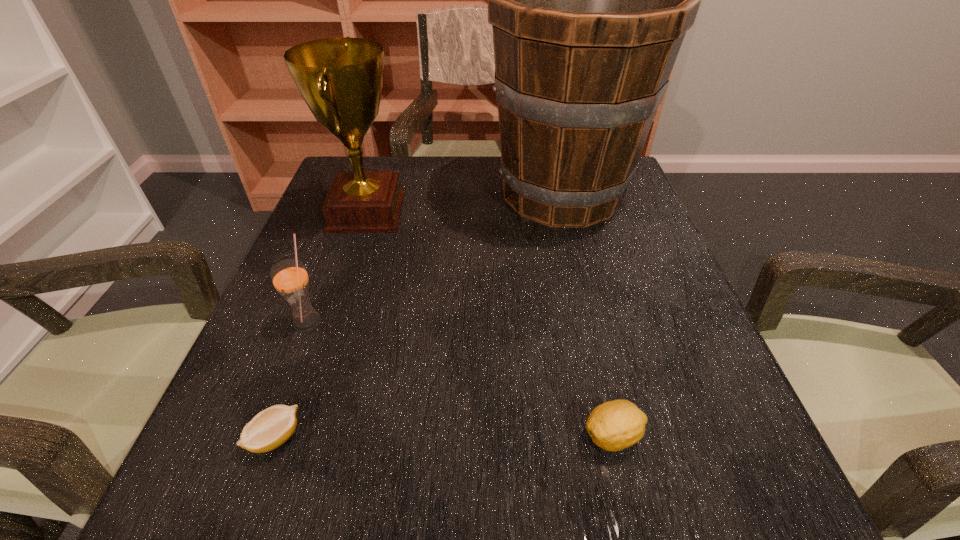
This screenshot has height=540, width=960. In order to click on free space at the near left corner in this screenshot , I will do `click(270, 508)`.

Where is `vacant space at the near right corner`? Image resolution: width=960 pixels, height=540 pixels. vacant space at the near right corner is located at coordinates (656, 457).

I want to click on free space between the straw and the second shortest object, so click(x=460, y=378).

Locate an element on the screen. Image resolution: width=960 pixels, height=540 pixels. empty location between the tallest object and the second tallest object is located at coordinates (465, 204).

This screenshot has height=540, width=960. Find the location of `empty space between the tallest object and the taller lemon`. empty space between the tallest object and the taller lemon is located at coordinates tap(588, 315).

This screenshot has width=960, height=540. I want to click on vacant region between the right lemon and the bucket, so pos(588,315).

Locate an element on the screen. The image size is (960, 540). vacant area that lies between the bucket and the third farthest object is located at coordinates (435, 257).

The width and height of the screenshot is (960, 540). Identify the location of free spot between the award and the right lemon. (490, 324).

Where is `unoccupied position between the bucket and the fourth tallest object`? unoccupied position between the bucket and the fourth tallest object is located at coordinates (588, 315).

At what (x,y) coordinates should I click in order to perform the action: click on vacant space in between the shortest object and the taller lemon. Please return your answer as a coordinate pair (x, y). This screenshot has height=540, width=960. Looking at the image, I should click on (444, 436).